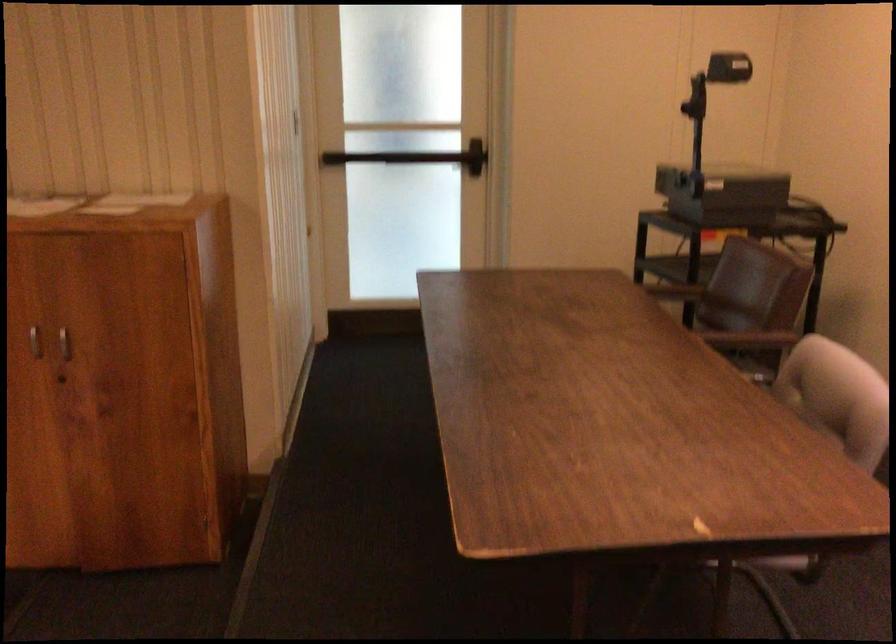
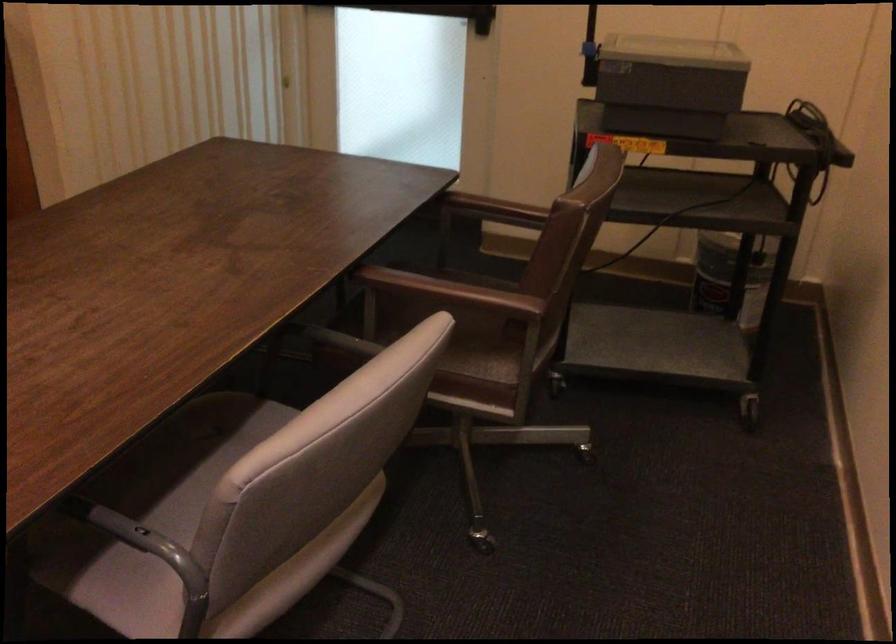
In the second image, find the point that corresponds to the point at 798,468 in the first image.

(140, 538)